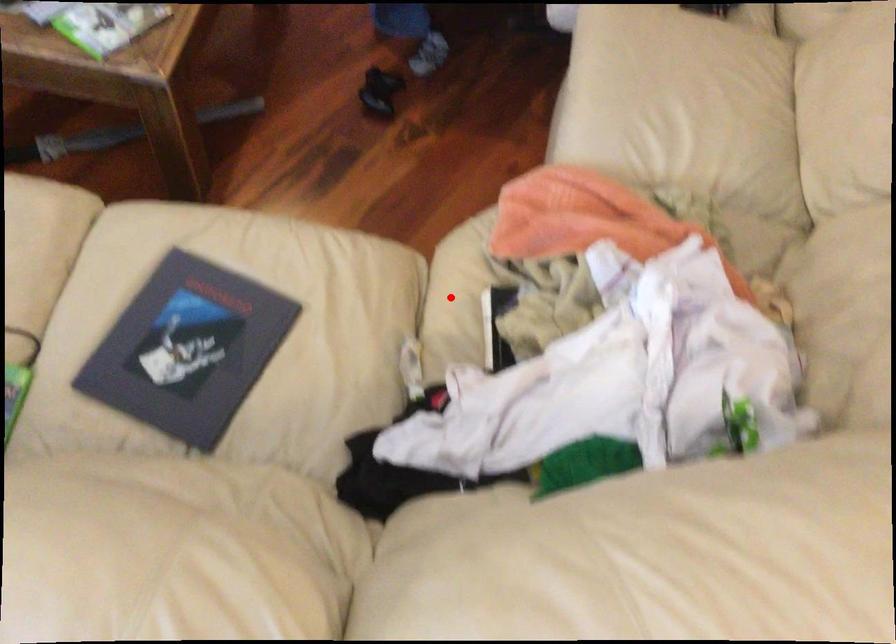
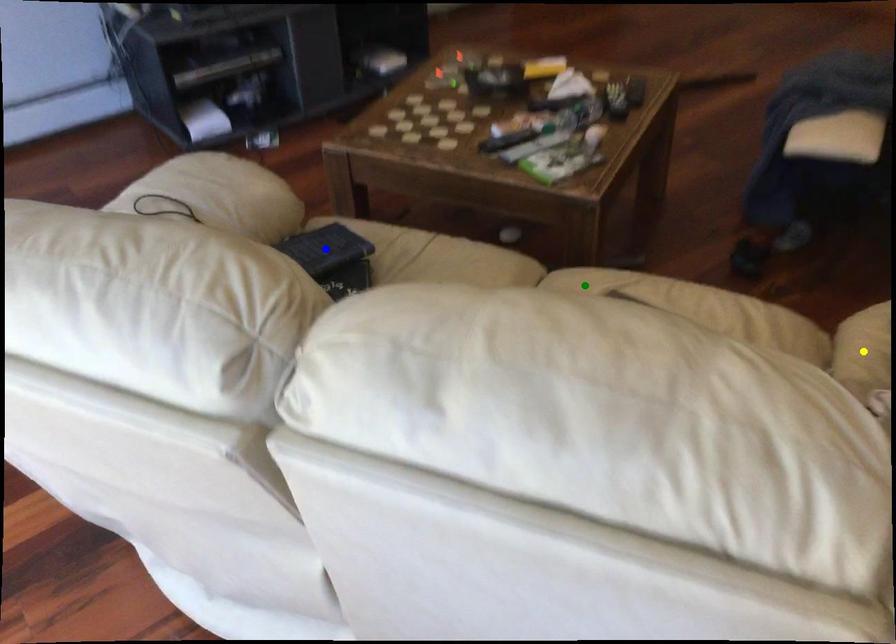
Question: I am providing you with two images of the same scene from different viewpoints. A red point is marked on the first image. You are given multiple points on the second image. In image 2, which mark is for the same physical point as the one in image 1?

Choices:
 (A) yellow point
 (B) green point
 (C) blue point

Answer: (A)